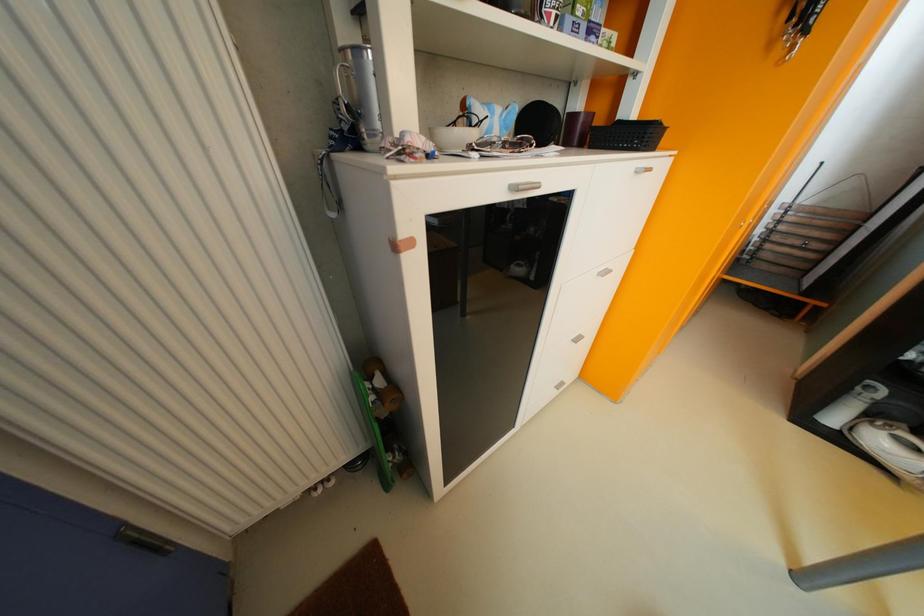
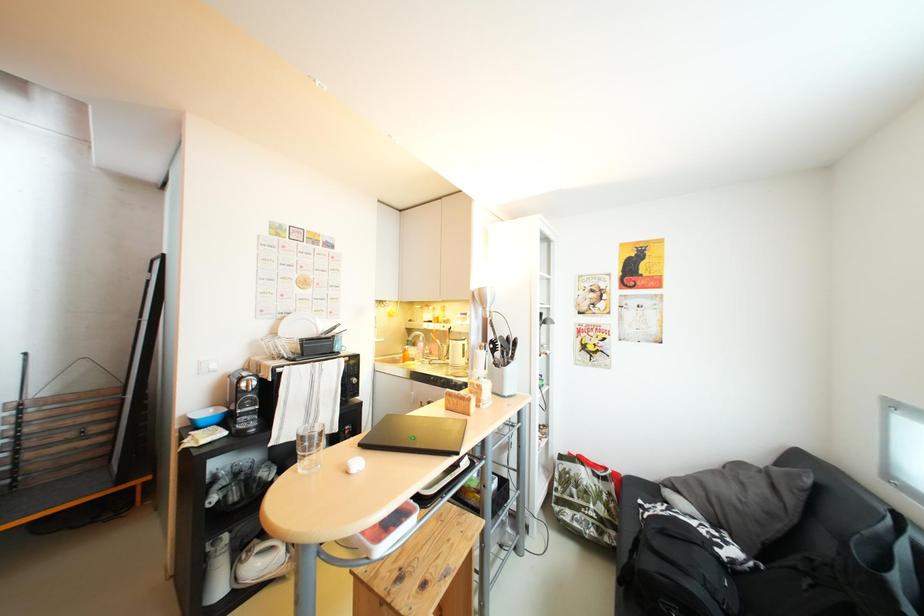
Question: Based on the continuous images, in which direction is the camera rotating? Reply with the corresponding letter.

Choices:
 (A) Left
 (B) Right
 (C) Up
 (D) Down

Answer: (B)